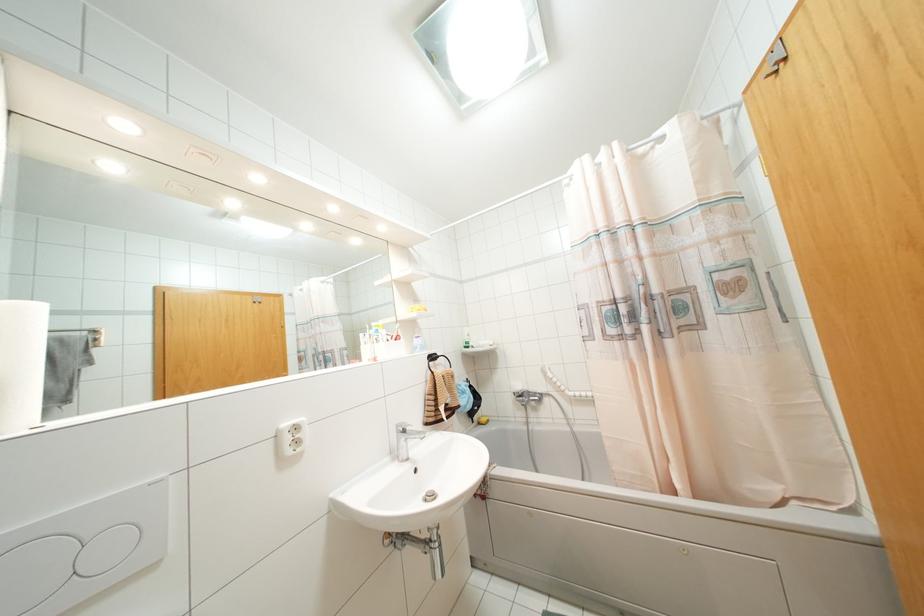
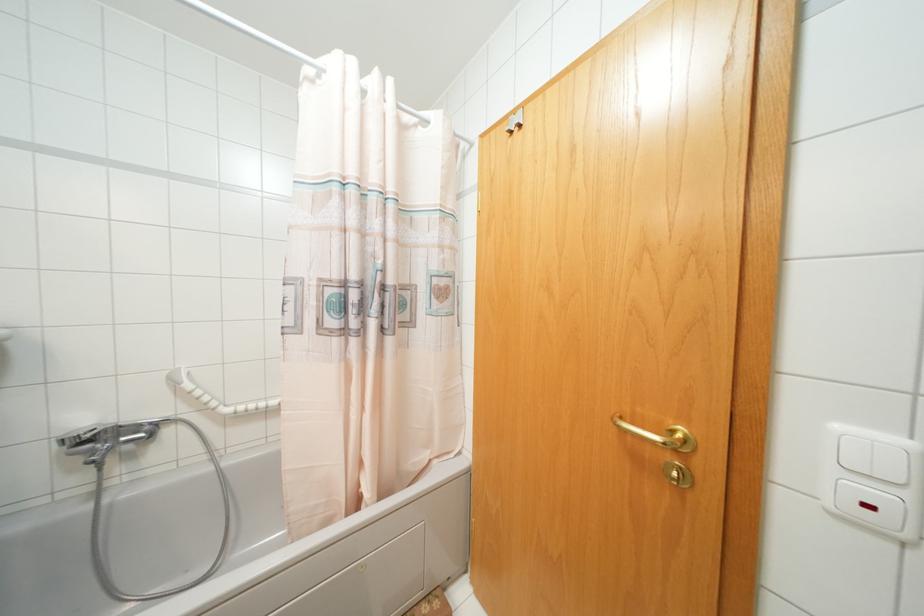
In the second image, find the point that corresponds to (x=518, y=395) in the first image.

(84, 440)